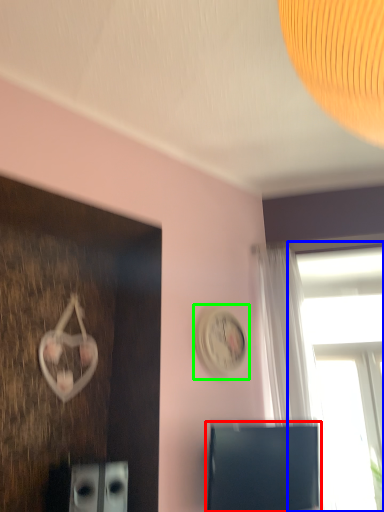
Question: Which object is positioned farthest from computer monitor (highlighted by a red box)? Select from window (highlighted by a blue box) and clock (highlighted by a green box).

Choices:
 (A) window
 (B) clock

Answer: (A)